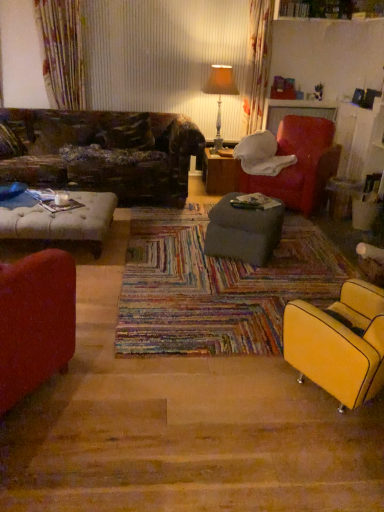
Question: Is leather-like brown pillow at upper left in front of or behind orange fabric lampshade at upper center in the image?

Choices:
 (A) front
 (B) behind

Answer: (A)

Question: Does point (115, 126) appear closer or farther from the camera than point (218, 75)?

Choices:
 (A) farther
 (B) closer

Answer: (B)

Question: Based on their relative distances, which object is nearer to the matte red armchair at upper right, which is the 2th chair in bottom-to-top order?

Choices:
 (A) wooden table at center, which is counted as the second table, starting from the front
 (B) orange fabric lampshade at upper center
 (C) matte yellow armchair at lower right, which ranks as the first chair in front-to-back order
 (D) gray fabric ottoman at center, placed as the 2th table when sorted from top to bottom
 (E) leather-like brown pillow at upper left

Answer: (A)

Question: Estimate the real-world distances between objects in this image. Which object is farther from the matte yellow armchair at lower right, which is the second chair from back to front?

Choices:
 (A) gray fabric ottoman at center, arranged as the 2th table when viewed from the back
 (B) wooden table at center, the 2th table from the bottom
 (C) leather-like brown pillow at upper left
 (D) orange fabric lampshade at upper center
 (E) matte red armchair at upper right, the 1th chair from the top

Answer: (D)